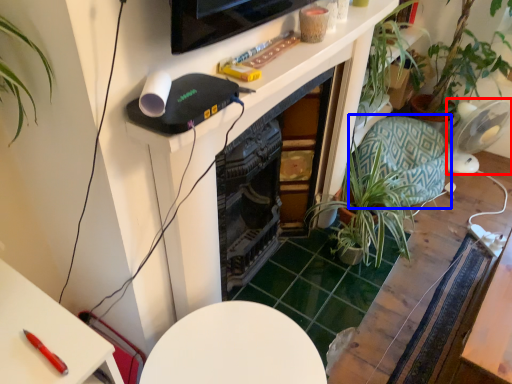
Question: Among these objects, which one is nearest to the camera, appliance (highlighted by a red box) or swivel chair (highlighted by a blue box)?

Choices:
 (A) appliance
 (B) swivel chair

Answer: (B)